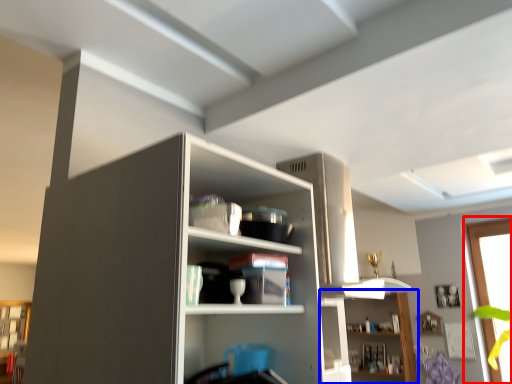
Question: Which of the following is the farthest to the observer, window (highlighted by a red box) or shelf (highlighted by a blue box)?

Choices:
 (A) window
 (B) shelf

Answer: (B)